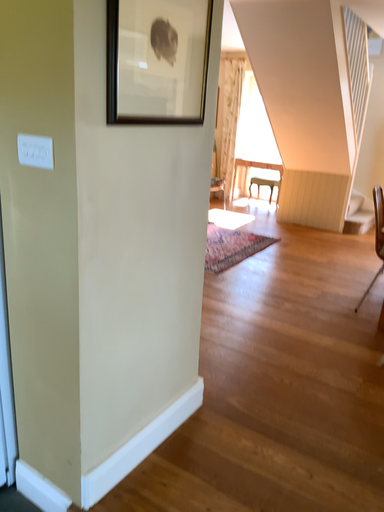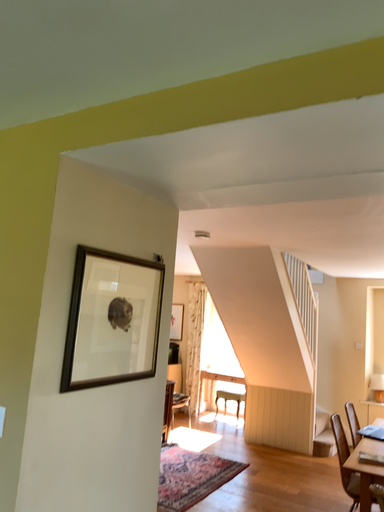
Question: How did the camera likely rotate when shooting the video?

Choices:
 (A) rotated upward
 (B) rotated downward

Answer: (A)